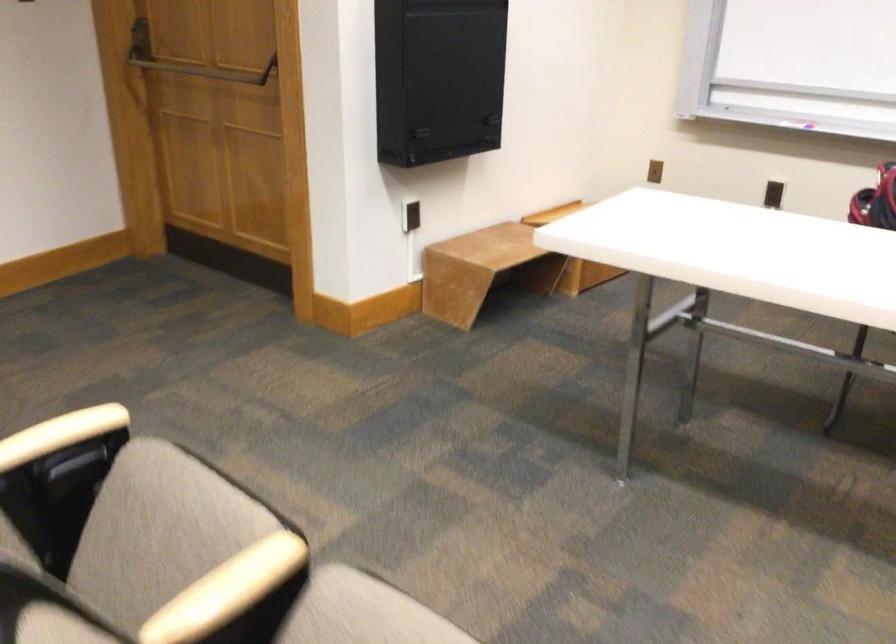
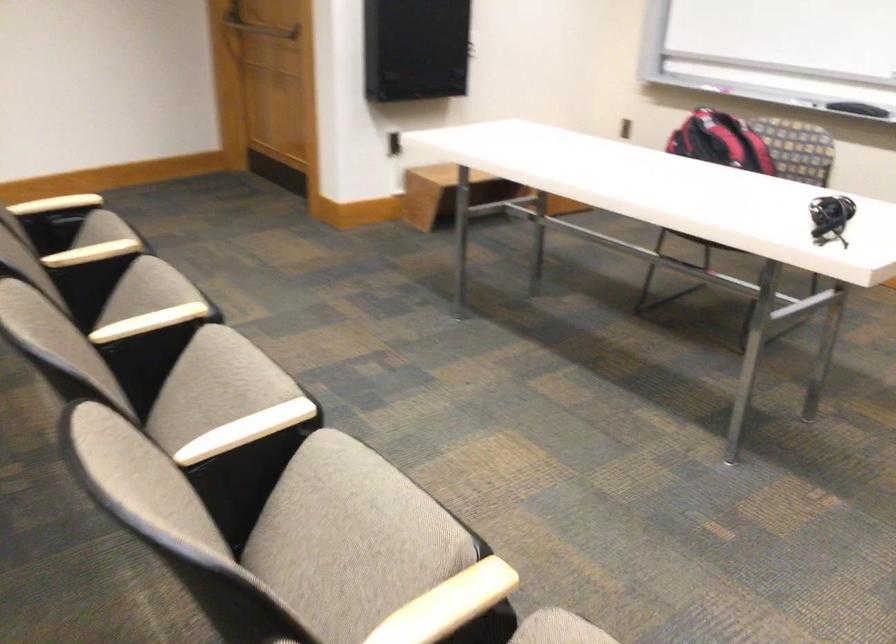
Locate, in the second image, the point that corresponds to [200,554] in the first image.

(92, 252)